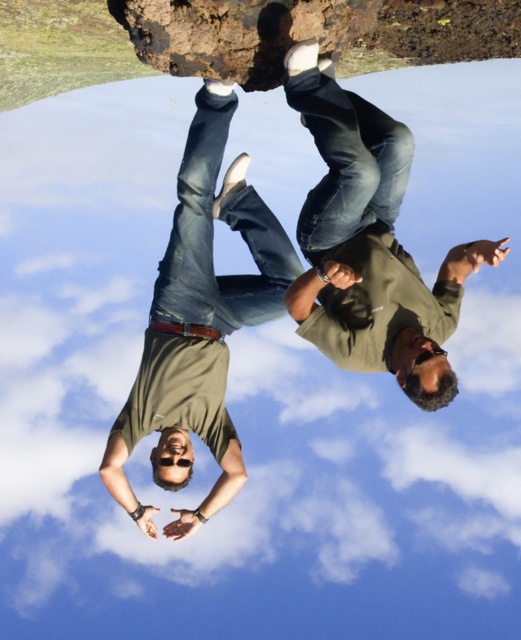
Between green matte shirt at center and matte khaki shirt at center, which one appears on the right side from the viewer's perspective?

green matte shirt at center is more to the right.

Does green matte shirt at center have a lesser width compared to matte khaki shirt at center?

Indeed, green matte shirt at center has a lesser width compared to matte khaki shirt at center.

Is point (342, 280) positioned behind point (160, 413)?

That is False.

Locate an element on the screen. green matte shirt at center is located at coordinates (369, 243).